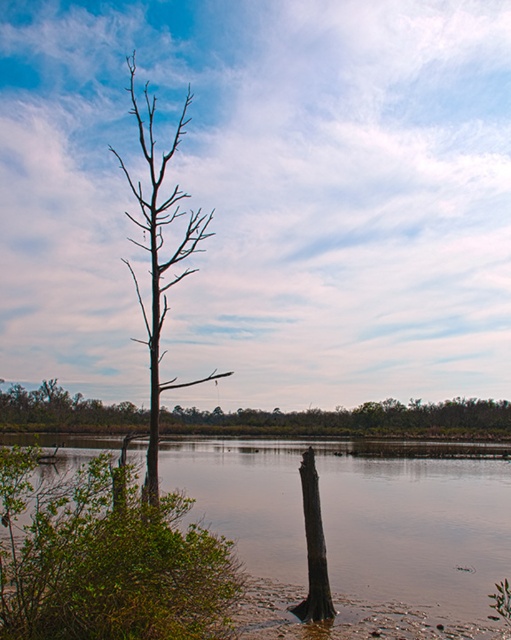
Question: Which of the following is the farthest from the observer?

Choices:
 (A) brown rough tree trunk at center
 (B) brown matte tree at center
 (C) brown wood tree at center

Answer: (C)

Question: Is brown muddy water at lower center wider than brown rough tree trunk at center?

Choices:
 (A) no
 (B) yes

Answer: (B)

Question: Is brown muddy water at lower center closer to camera compared to brown wood tree at center?

Choices:
 (A) no
 (B) yes

Answer: (B)

Question: Estimate the real-world distances between objects in this image. Which object is closer to the brown muddy water at lower center?

Choices:
 (A) brown matte tree at center
 (B) brown rough tree trunk at center
 (C) brown wood tree at center

Answer: (B)

Question: Which point is closer to the camera?

Choices:
 (A) (285, 470)
 (B) (307, 413)
 (C) (165, 296)

Answer: (C)

Question: Is brown muddy water at lower center to the left of brown matte tree at center from the viewer's perspective?

Choices:
 (A) yes
 (B) no

Answer: (B)